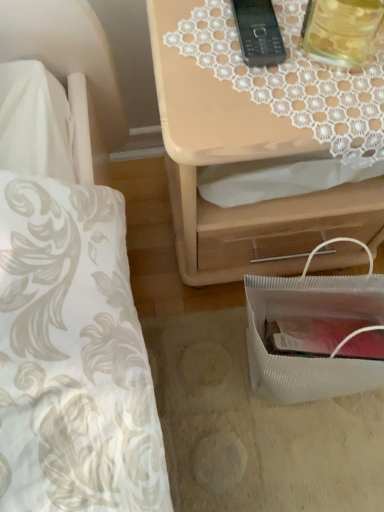
At what (x,y) coordinates should I click in order to perform the action: click on translucent glass jar at upper right. Please return your answer as a coordinate pair (x, y). The image size is (384, 512). Looking at the image, I should click on (341, 30).

What is the approximate width of translucent glass jar at upper right?

translucent glass jar at upper right is 2.56 inches in width.

In order to face black plastic phone at upper center, should I rotate leftwards or rightwards?

It's best to rotate right around 8.492 degrees.

The image size is (384, 512). What do you see at coordinates (236, 161) in the screenshot?
I see `light wood/texture nightstand at upper right` at bounding box center [236, 161].

You are a GUI agent. You are given a task and a screenshot of the screen. Output one action in this format:
    pyautogui.click(x=<x>, y=<y>)
    Task: Click on the translucent glass jar at upper right
    The image size is (384, 512).
    Given the screenshot: What is the action you would take?
    pyautogui.click(x=341, y=30)

Considering the positions of objects black plastic phone at upper center and white textured bag at lower right in the image provided, who is more to the right, black plastic phone at upper center or white textured bag at lower right?

Positioned to the right is white textured bag at lower right.

Considering the relative sizes of black plastic phone at upper center and white textured bag at lower right in the image provided, is black plastic phone at upper center shorter than white textured bag at lower right?

Yes, black plastic phone at upper center is shorter than white textured bag at lower right.

Considering the sizes of objects black plastic phone at upper center and white textured bag at lower right in the image provided, who is bigger, black plastic phone at upper center or white textured bag at lower right?

With larger size is white textured bag at lower right.

From the image's perspective, does black plastic phone at upper center appear lower than white textured bag at lower right?

No, from the image's perspective, black plastic phone at upper center is not below white textured bag at lower right.

Can you tell me how much translucent glass jar at upper right and black plastic phone at upper center differ in facing direction?

The facing directions of translucent glass jar at upper right and black plastic phone at upper center are 21.1 degrees apart.

Between translucent glass jar at upper right and black plastic phone at upper center, which one has smaller size?

Smaller between the two is black plastic phone at upper center.

From the image's perspective, is translucent glass jar at upper right beneath black plastic phone at upper center?

Indeed, from the image's perspective, translucent glass jar at upper right is shown beneath black plastic phone at upper center.

You are a GUI agent. You are given a task and a screenshot of the screen. Output one action in this format:
    pyautogui.click(x=<x>, y=<y>)
    Task: Click on the beverage on the right of black plastic phone at upper center
    
    Given the screenshot: What is the action you would take?
    pyautogui.click(x=341, y=30)

From a real-world perspective, is black plastic phone at upper center positioned above or below light wood/texture nightstand at upper right?

Clearly, from a real-world perspective, black plastic phone at upper center is above light wood/texture nightstand at upper right.

Does point (237, 14) come closer to viewer compared to point (241, 104)?

No, it is not.

At what (x,y) coordinates should I click in order to perform the action: click on gadget above the light wood/texture nightstand at upper right (from the image's perspective). Please return your answer as a coordinate pair (x, y). This screenshot has width=384, height=512. Looking at the image, I should click on (258, 32).

Is black plastic phone at upper center taller than light wood/texture nightstand at upper right?

In fact, black plastic phone at upper center may be shorter than light wood/texture nightstand at upper right.

Is light wood/texture nightstand at upper right completely or partially outside of translucent glass jar at upper right?

Yes, light wood/texture nightstand at upper right is located beyond the bounds of translucent glass jar at upper right.

In the scene shown: Is light wood/texture nightstand at upper right wider than translucent glass jar at upper right?

Yes.

Does light wood/texture nightstand at upper right come behind translucent glass jar at upper right?

Yes, light wood/texture nightstand at upper right is further from the camera.

Considering the relative sizes of light wood/texture nightstand at upper right and translucent glass jar at upper right in the image provided, is light wood/texture nightstand at upper right bigger than translucent glass jar at upper right?

Indeed, light wood/texture nightstand at upper right has a larger size compared to translucent glass jar at upper right.

In the scene shown: Does translucent glass jar at upper right have a lesser height compared to white textured bag at lower right?

Yes.

At what (x,y) coordinates should I click in order to perform the action: click on bag to the right of translucent glass jar at upper right. Please return your answer as a coordinate pair (x, y). The width and height of the screenshot is (384, 512). Looking at the image, I should click on (315, 333).

From the image's perspective, would you say translucent glass jar at upper right is positioned over white textured bag at lower right?

Yes, from the image's perspective, translucent glass jar at upper right is on top of white textured bag at lower right.

The width and height of the screenshot is (384, 512). Identify the location of bag beneath the light wood/texture nightstand at upper right (from a real-world perspective). (315, 333).

Is white textured bag at lower right oriented away from light wood/texture nightstand at upper right?

Yes, white textured bag at lower right is facing away from light wood/texture nightstand at upper right.

Is white textured bag at lower right with light wood/texture nightstand at upper right?

No, white textured bag at lower right is not beside light wood/texture nightstand at upper right.

Considering the relative sizes of white textured bag at lower right and light wood/texture nightstand at upper right in the image provided, is white textured bag at lower right thinner than light wood/texture nightstand at upper right?

Yes, white textured bag at lower right is thinner than light wood/texture nightstand at upper right.

Considering the sizes of objects white textured bag at lower right and translucent glass jar at upper right in the image provided, who is shorter, white textured bag at lower right or translucent glass jar at upper right?

Standing shorter between the two is translucent glass jar at upper right.

Is white textured bag at lower right bigger or smaller than translucent glass jar at upper right?

Considering their sizes, white textured bag at lower right takes up more space than translucent glass jar at upper right.

Considering the positions of points (249, 319) and (329, 53), is point (249, 319) closer to camera compared to point (329, 53)?

That is False.

This screenshot has height=512, width=384. I want to click on bag on the right side of black plastic phone at upper center, so pyautogui.click(x=315, y=333).

Locate an element on the screen. The image size is (384, 512). gadget behind the translucent glass jar at upper right is located at coordinates point(258,32).

Estimate the real-world distances between objects in this image. Which object is closer to light wood/texture nightstand at upper right, black plastic phone at upper center or white textured bag at lower right?

white textured bag at lower right lies closer to light wood/texture nightstand at upper right than the other object.

Based on the photo, considering their positions, is translucent glass jar at upper right positioned further to light wood/texture nightstand at upper right than black plastic phone at upper center?

black plastic phone at upper center.

Looking at the image, which one is located further to light wood/texture nightstand at upper right, translucent glass jar at upper right or white textured bag at lower right?

translucent glass jar at upper right is further to light wood/texture nightstand at upper right.

When comparing their distances from white textured bag at lower right, does black plastic phone at upper center or light wood/texture nightstand at upper right seem further?

black plastic phone at upper center is positioned further to the anchor white textured bag at lower right.

From the picture: From the image, which object appears to be farther from light wood/texture nightstand at upper right, white textured bag at lower right or translucent glass jar at upper right?

translucent glass jar at upper right lies further to light wood/texture nightstand at upper right than the other object.

Looking at the image, which one is located further to black plastic phone at upper center, light wood/texture nightstand at upper right or translucent glass jar at upper right?

light wood/texture nightstand at upper right.

Considering their positions, is black plastic phone at upper center positioned further to translucent glass jar at upper right than white textured bag at lower right?

Among the two, white textured bag at lower right is located further to translucent glass jar at upper right.

When comparing their distances from white textured bag at lower right, does black plastic phone at upper center or translucent glass jar at upper right seem closer?

Among the two, translucent glass jar at upper right is located nearer to white textured bag at lower right.

Identify the location of beverage between black plastic phone at upper center and white textured bag at lower right in the up-down direction. This screenshot has height=512, width=384. (341, 30).

Locate an element on the screen. Image resolution: width=384 pixels, height=512 pixels. nightstand between black plastic phone at upper center and white textured bag at lower right vertically is located at coordinates [x=236, y=161].

Image resolution: width=384 pixels, height=512 pixels. What are the coordinates of `beverage that lies between black plastic phone at upper center and light wood/texture nightstand at upper right from top to bottom` in the screenshot? It's located at (341, 30).

Identify the location of nightstand that lies between translucent glass jar at upper right and white textured bag at lower right from top to bottom. The image size is (384, 512). (236, 161).